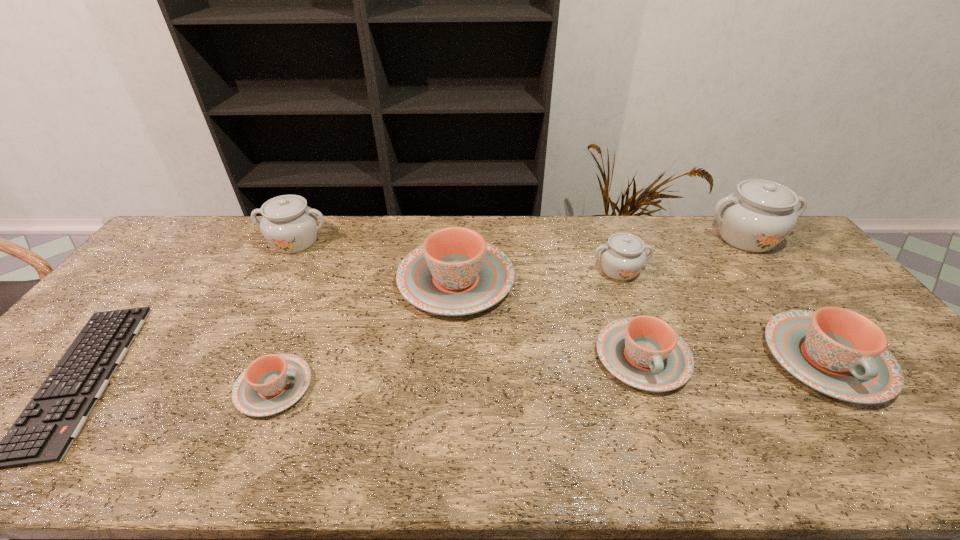
Locate an element on the screen. The height and width of the screenshot is (540, 960). the tallest chinaware is located at coordinates (757, 217).

Image resolution: width=960 pixels, height=540 pixels. Find the location of `the biggest white chinaware`. the biggest white chinaware is located at coordinates (757, 217).

What are the coordinates of `the second biggest white chinaware` in the screenshot? It's located at (290, 226).

I want to click on the leftmost white chinaware, so click(x=290, y=226).

Find the location of `the fifth chinaware from right to left`. the fifth chinaware from right to left is located at coordinates (455, 272).

Locate an element on the screen. The image size is (960, 540). the biggest pink chinaware is located at coordinates (455, 272).

The height and width of the screenshot is (540, 960). I want to click on the second white chinaware from left to right, so click(622, 257).

The width and height of the screenshot is (960, 540). Find the location of `the rightmost pink chinaware`. the rightmost pink chinaware is located at coordinates (x=836, y=351).

This screenshot has height=540, width=960. I want to click on the third shortest object, so click(x=644, y=352).

At what (x,y) coordinates should I click in order to perform the action: click on the sixth tallest chinaware. Please return your answer as a coordinate pair (x, y). This screenshot has height=540, width=960. Looking at the image, I should click on coord(644,352).